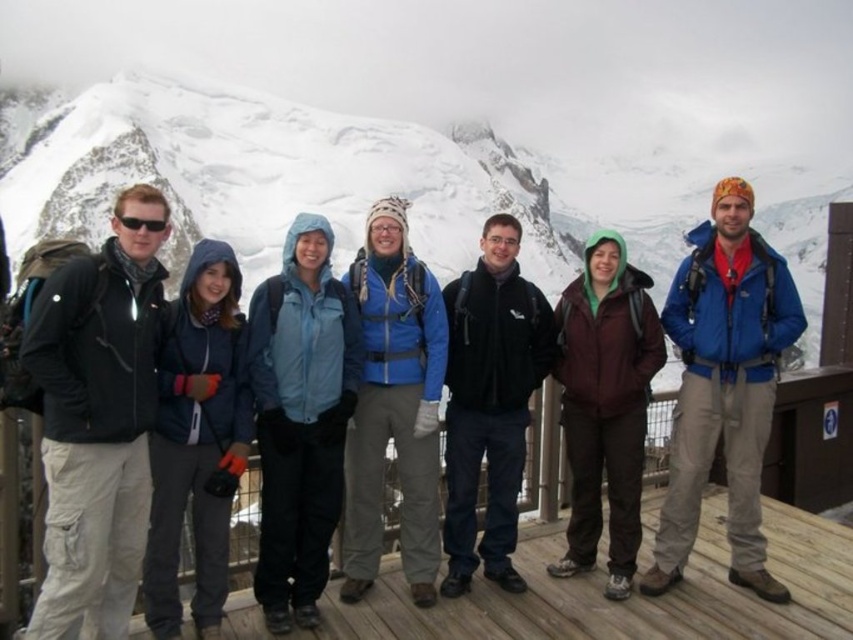
Measure the distance from matte black jacket at left to blue fleece jacket at center.

matte black jacket at left and blue fleece jacket at center are 27.38 meters apart from each other.

The width and height of the screenshot is (853, 640). In order to click on matte black jacket at left in this screenshot , I will do `click(97, 419)`.

This screenshot has height=640, width=853. What do you see at coordinates (97, 419) in the screenshot?
I see `matte black jacket at left` at bounding box center [97, 419].

Where is `matte black jacket at left`? This screenshot has height=640, width=853. matte black jacket at left is located at coordinates (97, 419).

Is matte black jacket at left to the right of black fleece jacket at center from the viewer's perspective?

In fact, matte black jacket at left is to the left of black fleece jacket at center.

Who is higher up, matte black jacket at left or black fleece jacket at center?

matte black jacket at left is higher up.

Is point (59, 273) less distant than point (453, 285)?

Yes.

Where is `matte black jacket at left`? This screenshot has height=640, width=853. matte black jacket at left is located at coordinates (97, 419).

Is matte black jacket at left shorter than wooden deck at center?

No, matte black jacket at left is not shorter than wooden deck at center.

The image size is (853, 640). Describe the element at coordinates (97, 419) in the screenshot. I see `matte black jacket at left` at that location.

Locate an element on the screen. matte black jacket at left is located at coordinates (97, 419).